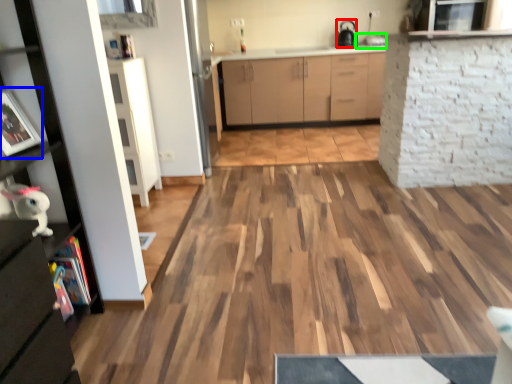
Question: Which object is positioned farthest from appliance (highlighted by a red box)? Select from picture frame (highlighted by a blue box) and sink (highlighted by a green box).

Choices:
 (A) picture frame
 (B) sink

Answer: (A)